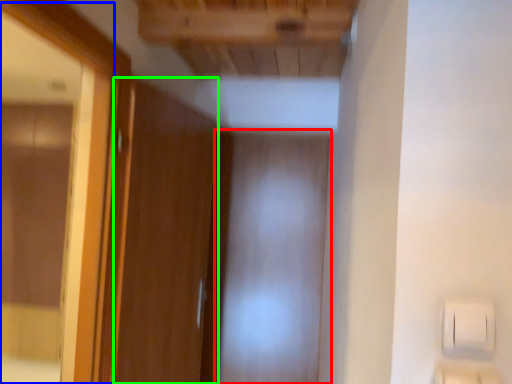
Question: Which is farther away from screen door (highlighted by a red box)? mirror (highlighted by a blue box) or door (highlighted by a green box)?

Choices:
 (A) mirror
 (B) door

Answer: (A)